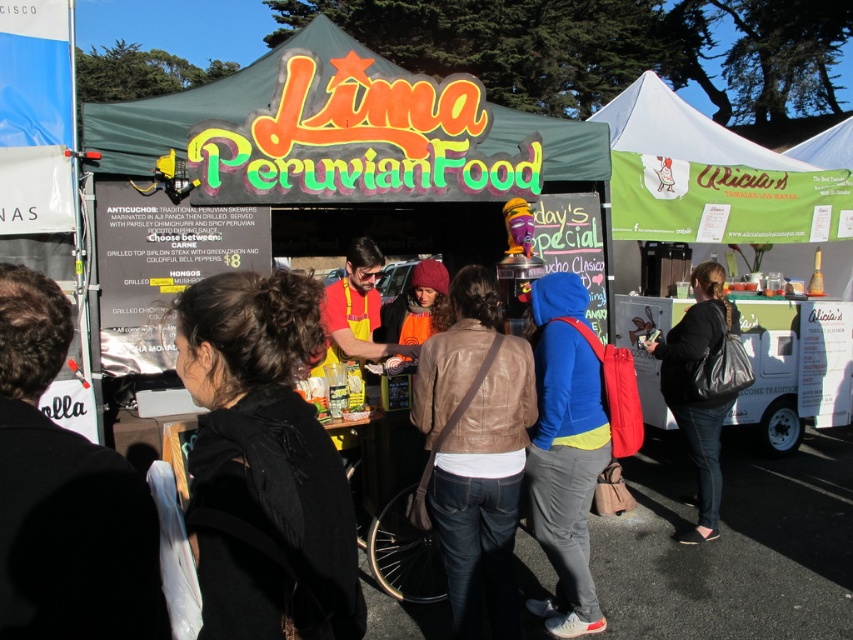
Between black leather jacket at lower left and blue fleece jacket at center, which one is positioned higher?

black leather jacket at lower left is above.

Is black leather jacket at lower left behind blue fleece jacket at center?

A: That is False.

Is point (15, 426) positioned before point (604, 426)?

Yes, point (15, 426) is closer to viewer.

Image resolution: width=853 pixels, height=640 pixels. Find the location of `black leather jacket at lower left`. black leather jacket at lower left is located at coordinates (64, 496).

Who is positioned more to the left, black leather jacket at lower left or green canvas tent at center?

green canvas tent at center is more to the left.

Who is positioned more to the right, black leather jacket at lower left or green canvas tent at center?

black leather jacket at lower left

Identify the location of black leather jacket at lower left. This screenshot has height=640, width=853. (64, 496).

Find the location of `black leather jacket at lower left`. black leather jacket at lower left is located at coordinates (64, 496).

Is brown leather jacket at center thinner than white cardboard food truck at right?

Yes, brown leather jacket at center is thinner than white cardboard food truck at right.

Can you confirm if brown leather jacket at center is positioned to the left of white cardboard food truck at right?

Correct, you'll find brown leather jacket at center to the left of white cardboard food truck at right.

At what (x,y) coordinates should I click in order to perform the action: click on brown leather jacket at center. Please return your answer as a coordinate pair (x, y). Looking at the image, I should click on (476, 452).

Locate an element on the screen. Image resolution: width=853 pixels, height=640 pixels. brown leather jacket at center is located at coordinates (476, 452).